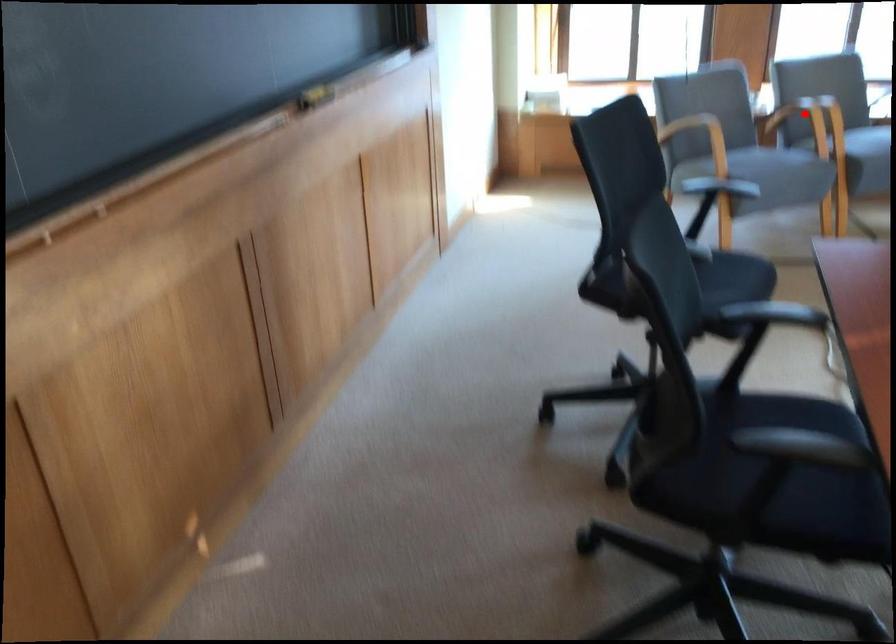
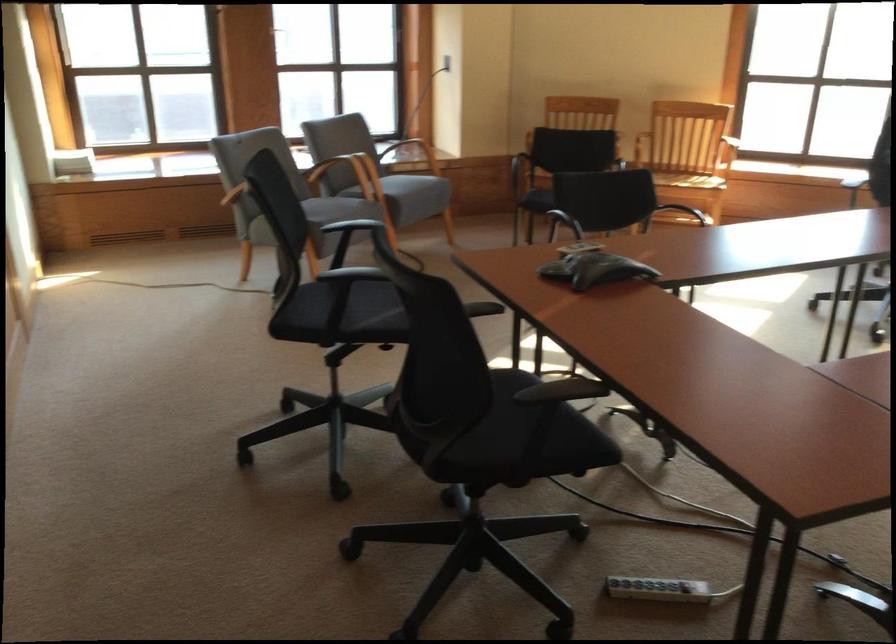
Question: A red point is marked in image1. In image2, is the corresponding 3D point closer to the camera or farther? Reply with the corresponding letter.

Choices:
 (A) The corresponding 3D point is closer.
 (B) The corresponding 3D point is farther.

Answer: (B)